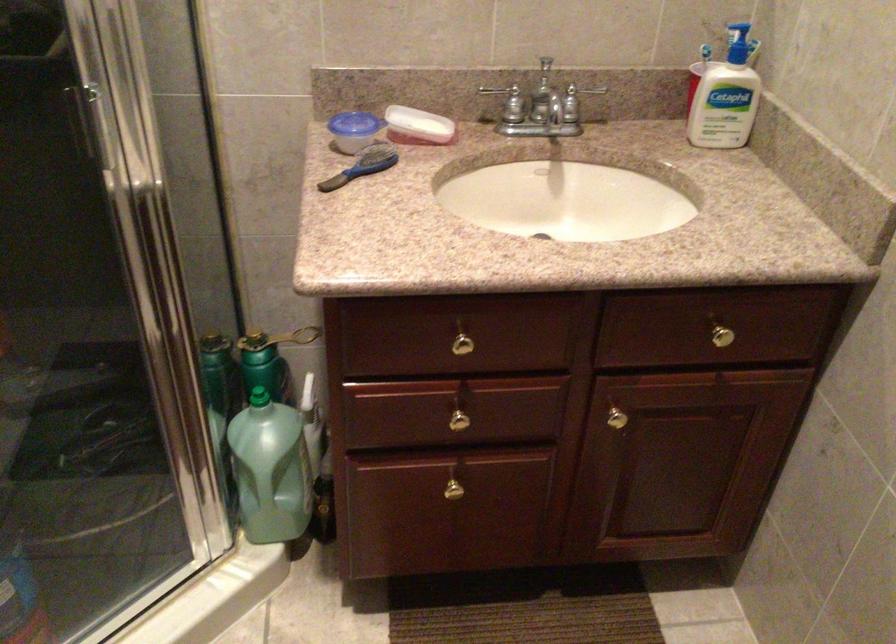
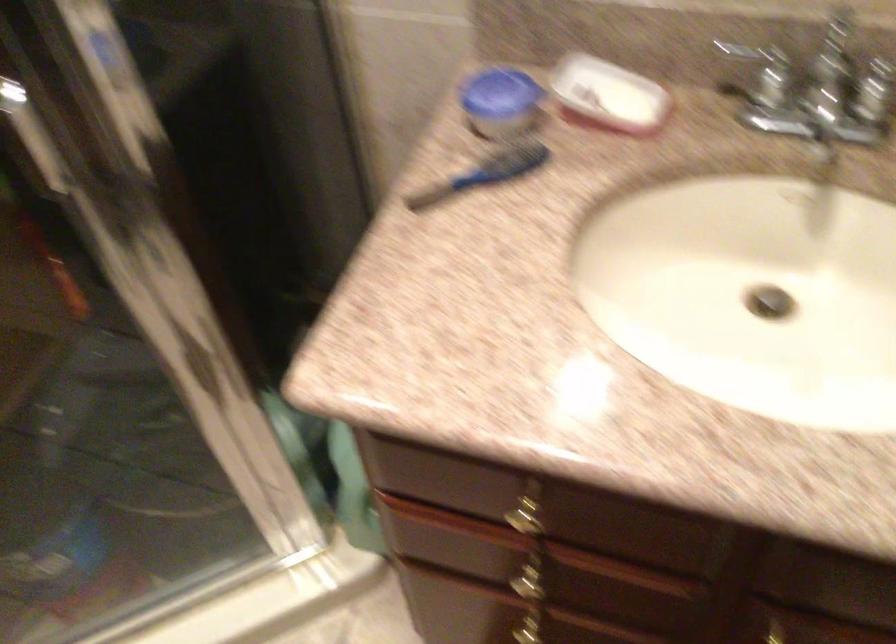
How did the camera likely rotate?

The camera's rotation is toward left-down.